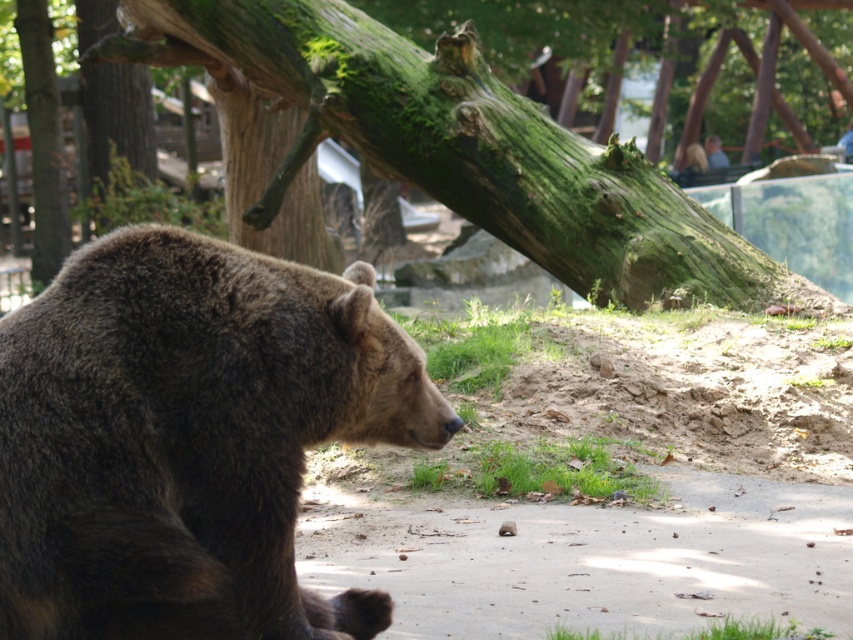
Question: Among these objects, which one is nearest to the camera?

Choices:
 (A) green mossy log at upper center
 (B) brown furry bear at center

Answer: (B)

Question: Where is brown furry bear at center located in relation to green mossy log at upper center in the image?

Choices:
 (A) above
 (B) below

Answer: (B)

Question: Which object appears closest to the camera in this image?

Choices:
 (A) brown furry bear at center
 (B) green mossy log at upper center

Answer: (A)

Question: Does brown furry bear at center have a larger size compared to green mossy log at upper center?

Choices:
 (A) no
 (B) yes

Answer: (A)

Question: Is the position of brown furry bear at center less distant than that of green mossy log at upper center?

Choices:
 (A) yes
 (B) no

Answer: (A)